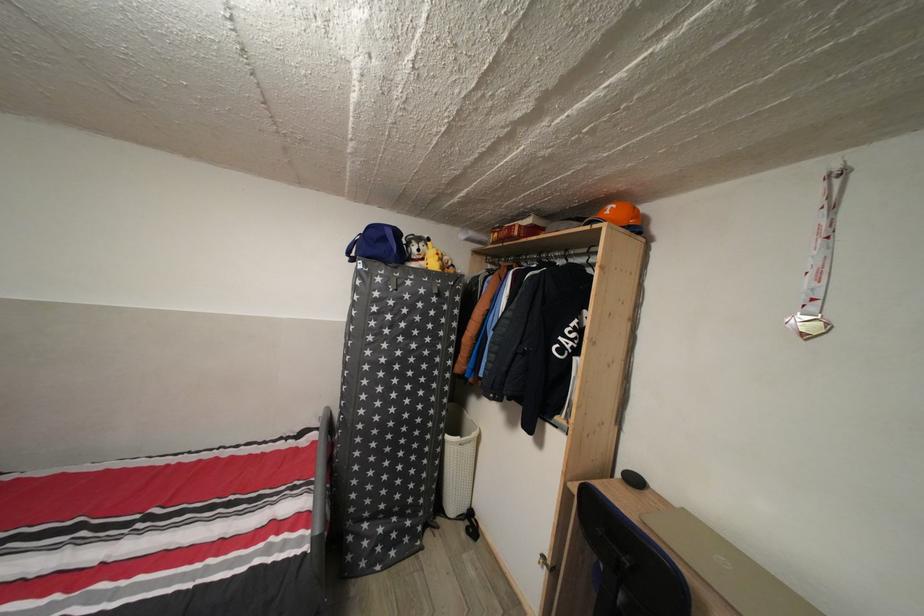
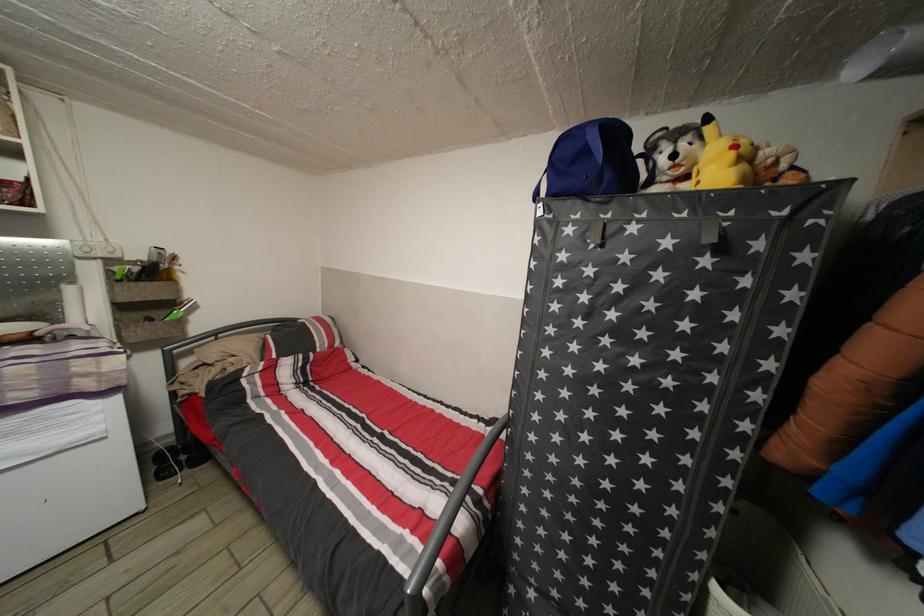
Where in the second image is the point corresponding to the point at 455,444 from the first image?

(723, 594)